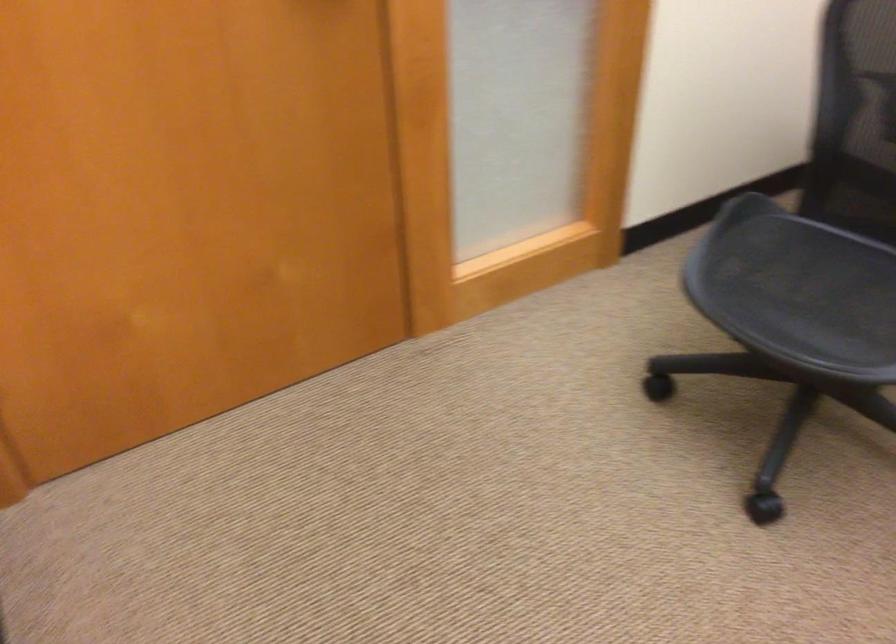
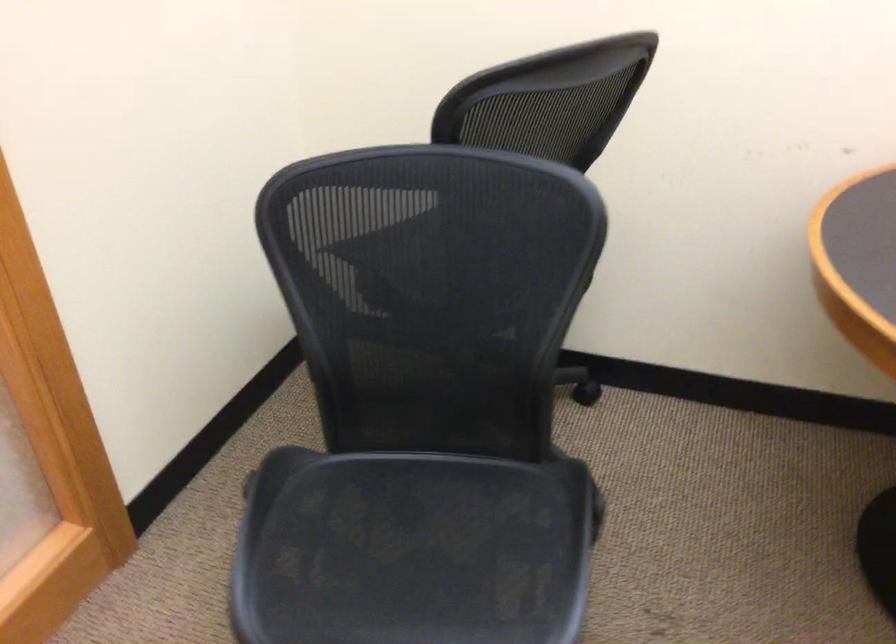
Question: The first image is from the beginning of the video and the second image is from the end. How did the camera likely rotate when shooting the video?

Choices:
 (A) Left
 (B) Right
 (C) Up
 (D) Down

Answer: (B)